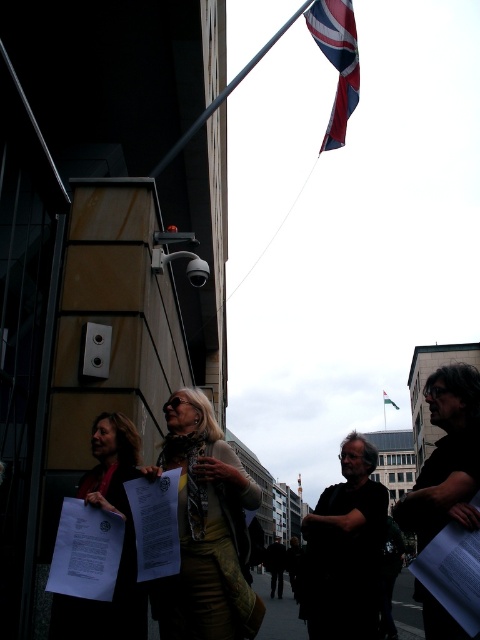
You are a delivery person trying to locate the doorbell system on a building. You see the red and blue fabric flag at upper right and the metallic pole at upper center. Which object is closer to the doorbell system?

The metallic pole at upper center is closer to the doorbell system because it is positioned at the upper center, which is typically where doorbell systems are placed on buildings, while the red and blue fabric flag at upper right is located further away at the upper right corner.